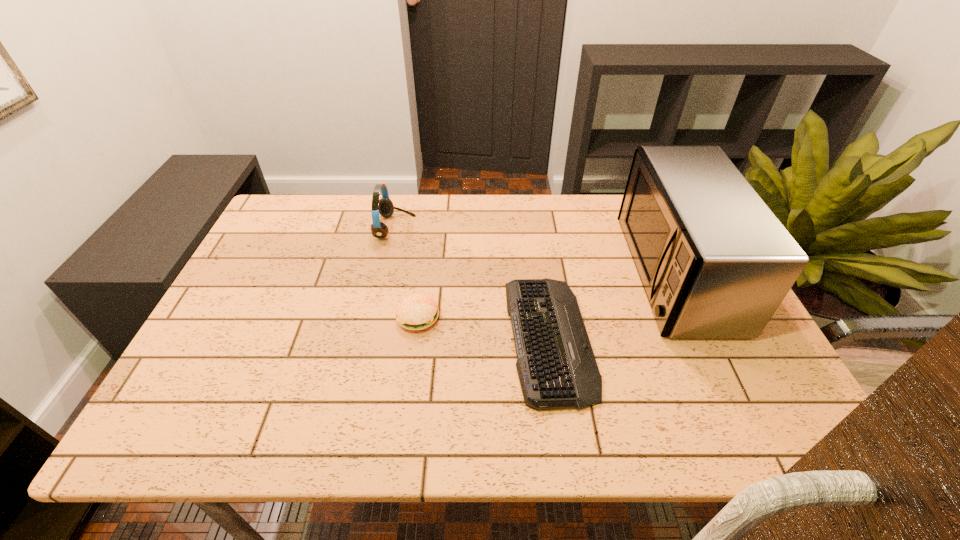
This screenshot has width=960, height=540. In order to click on free spot that satisfies the following two spatial constraints: 1. with the microphone attached to the side of the headset; 2. on the back side of the second object from right to left in this screenshot , I will do `click(371, 338)`.